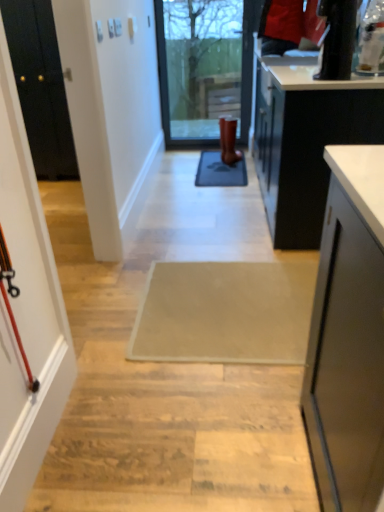
Question: Is the depth of brown leather boot at center greater than that of gray rubber doormat at center, positioned as the second doormat in front-to-back order?

Choices:
 (A) yes
 (B) no

Answer: (A)

Question: Would you say brown leather boot at center is outside gray rubber doormat at center, placed as the first doormat when sorted from top to bottom?

Choices:
 (A) yes
 (B) no

Answer: (A)

Question: Is brown leather boot at center with gray rubber doormat at center, placed as the first doormat when sorted from top to bottom?

Choices:
 (A) yes
 (B) no

Answer: (B)

Question: From a real-world perspective, is brown leather boot at center located beneath gray rubber doormat at center, placed as the first doormat when sorted from top to bottom?

Choices:
 (A) yes
 (B) no

Answer: (B)

Question: Is brown leather boot at center not near gray rubber doormat at center, marked as the second doormat in a bottom-to-top arrangement?

Choices:
 (A) yes
 (B) no

Answer: (B)

Question: Do you think beige fabric doormat at center, which is the second doormat from back to front, is within matte black screen door at left, or outside of it?

Choices:
 (A) outside
 (B) inside

Answer: (A)

Question: Is beige fabric doormat at center, marked as the second doormat in a top-to-bottom arrangement, in front of or behind matte black screen door at left in the image?

Choices:
 (A) behind
 (B) front

Answer: (A)

Question: Is beige fabric doormat at center, which is the second doormat from back to front, to the left or to the right of matte black screen door at left in the image?

Choices:
 (A) left
 (B) right

Answer: (B)

Question: Looking at the image, does beige fabric doormat at center, marked as the second doormat in a top-to-bottom arrangement, seem bigger or smaller compared to matte black screen door at left?

Choices:
 (A) big
 (B) small

Answer: (B)

Question: From the image's perspective, relative to gray rubber doormat at center, marked as the second doormat in a bottom-to-top arrangement, is brown leather boot at center above or below?

Choices:
 (A) above
 (B) below

Answer: (A)

Question: Considering the positions of brown leather boot at center and gray rubber doormat at center, placed as the first doormat when sorted from top to bottom, in the image, is brown leather boot at center taller or shorter than gray rubber doormat at center, placed as the first doormat when sorted from top to bottom,?

Choices:
 (A) short
 (B) tall

Answer: (B)

Question: From a real-world perspective, is brown leather boot at center above or below gray rubber doormat at center, positioned as the second doormat in front-to-back order?

Choices:
 (A) above
 (B) below

Answer: (A)

Question: Based on their positions, is brown leather boot at center located to the left or right of gray rubber doormat at center, marked as the second doormat in a bottom-to-top arrangement?

Choices:
 (A) left
 (B) right

Answer: (B)

Question: Is matte black screen door at left taller or shorter than white glossy countertop at upper right?

Choices:
 (A) tall
 (B) short

Answer: (A)

Question: Considering the positions of point (13, 367) and point (283, 62), is point (13, 367) closer or farther from the camera than point (283, 62)?

Choices:
 (A) closer
 (B) farther

Answer: (A)